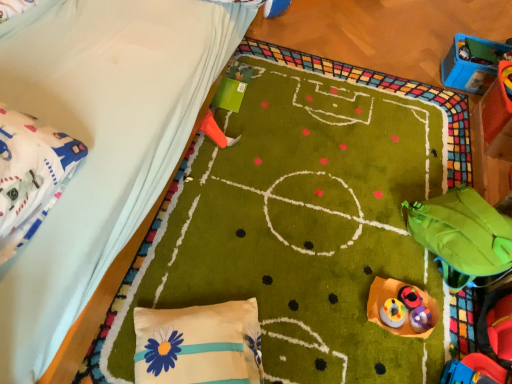
The width and height of the screenshot is (512, 384). What are the coordinates of `free space in front of rubberized yellow toy at center, the 3th toy in the bottom-to-top sequence` in the screenshot? It's located at (390, 337).